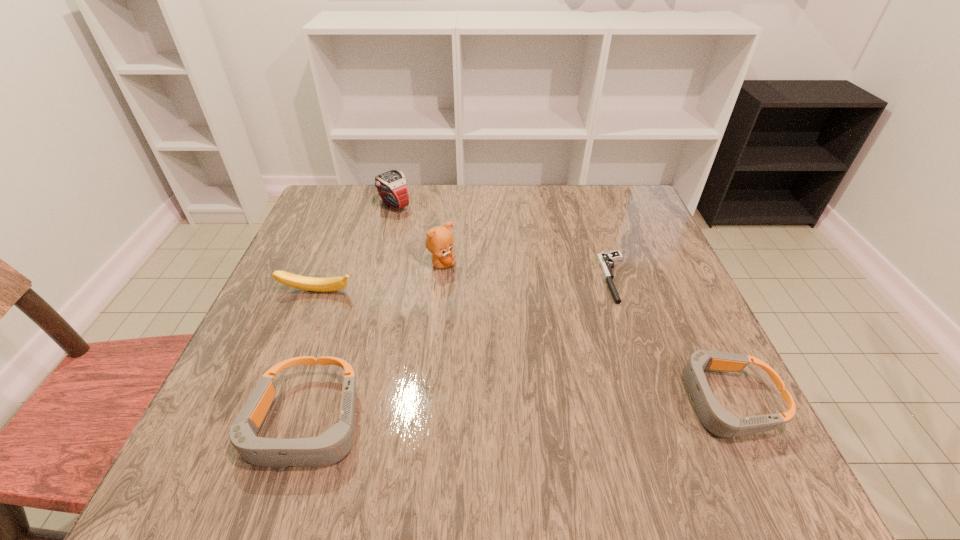
Image resolution: width=960 pixels, height=540 pixels. Find the location of `vacant space in between the left goggles and the tallest object`. vacant space in between the left goggles and the tallest object is located at coordinates (373, 344).

Identify the location of object that stands as the second closest to the pistol. This screenshot has width=960, height=540. (439, 241).

Locate an element on the screen. The height and width of the screenshot is (540, 960). the second closest object relative to the shortest object is located at coordinates (439, 241).

In order to click on vacant space that satisfies the following two spatial constraints: 1. on the front-facing side of the shortest object; 2. at the stem of the banana in this screenshot , I will do `click(620, 292)`.

This screenshot has width=960, height=540. Find the location of `free space in the image that satisfies the following two spatial constraints: 1. on the front-facing side of the shortest object; 2. at the stem of the banana`. free space in the image that satisfies the following two spatial constraints: 1. on the front-facing side of the shortest object; 2. at the stem of the banana is located at coordinates (620, 292).